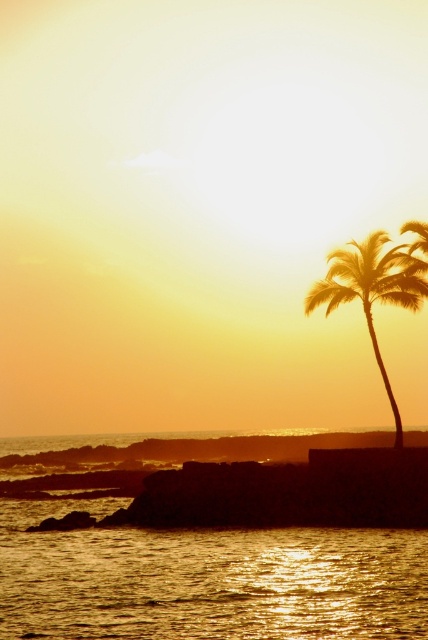
Is golden reflective water at center thinner than silhouette palm tree at right?

No, golden reflective water at center is not thinner than silhouette palm tree at right.

Who is positioned more to the left, golden reflective water at center or silhouette palm tree at right?

Positioned to the left is golden reflective water at center.

Who is more distant from viewer, (228, 561) or (362, 243)?

The point (362, 243) is behind.

At what (x,y) coordinates should I click in order to perform the action: click on golden reflective water at center. Please return your answer as a coordinate pair (x, y). Looking at the image, I should click on (205, 580).